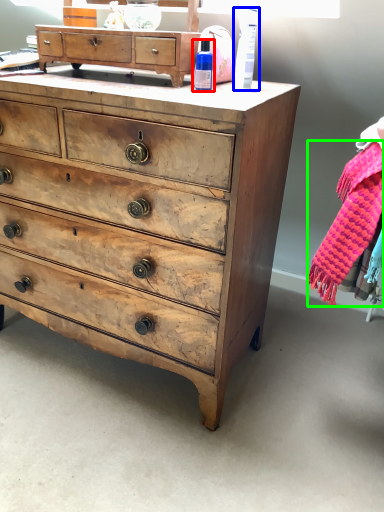
Question: Which object is positioned closest to toiletry (highlighted by a red box)? Select from toiletry (highlighted by a blue box) and clothing (highlighted by a green box).

Choices:
 (A) toiletry
 (B) clothing

Answer: (A)